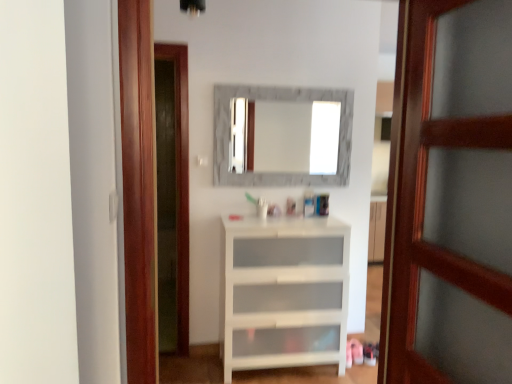
Question: From a real-world perspective, is white glossy cabinet at center positioned under white glossy cabinet at center based on gravity?

Choices:
 (A) yes
 (B) no

Answer: (B)

Question: Could you tell me if white glossy cabinet at center is turned towards white glossy cabinet at center?

Choices:
 (A) no
 (B) yes

Answer: (A)

Question: Is white glossy cabinet at center to the right of white glossy cabinet at center from the viewer's perspective?

Choices:
 (A) no
 (B) yes

Answer: (A)

Question: Is white glossy cabinet at center bigger than white glossy cabinet at center?

Choices:
 (A) no
 (B) yes

Answer: (B)

Question: Is the position of white glossy cabinet at center more distant than that of white glossy cabinet at center?

Choices:
 (A) yes
 (B) no

Answer: (B)

Question: Based on their positions, is wooden door at right located to the left or right of white glossy cabinet at center?

Choices:
 (A) right
 (B) left

Answer: (A)

Question: From the image's perspective, is wooden door at right above or below white glossy cabinet at center?

Choices:
 (A) above
 (B) below

Answer: (A)

Question: Is wooden door at right wider or thinner than white glossy cabinet at center?

Choices:
 (A) thin
 (B) wide

Answer: (A)

Question: Considering the positions of wooden door at right and white glossy cabinet at center in the image, is wooden door at right bigger or smaller than white glossy cabinet at center?

Choices:
 (A) big
 (B) small

Answer: (B)

Question: Is wooden door at right taller or shorter than white glossy cabinet at center?

Choices:
 (A) short
 (B) tall

Answer: (B)

Question: From a real-world perspective, relative to white glossy cabinet at center, is wooden door at right vertically above or below?

Choices:
 (A) above
 (B) below

Answer: (A)

Question: Looking at the image, does wooden door at right seem bigger or smaller compared to white glossy cabinet at center?

Choices:
 (A) big
 (B) small

Answer: (A)

Question: Is wooden door at right in front of or behind white glossy cabinet at center in the image?

Choices:
 (A) behind
 (B) front

Answer: (B)

Question: From a real-world perspective, is white glossy cabinet at center physically located above or below marble frame mirror at center?

Choices:
 (A) below
 (B) above

Answer: (A)

Question: Does point (320, 309) appear closer or farther from the camera than point (283, 155)?

Choices:
 (A) closer
 (B) farther

Answer: (A)